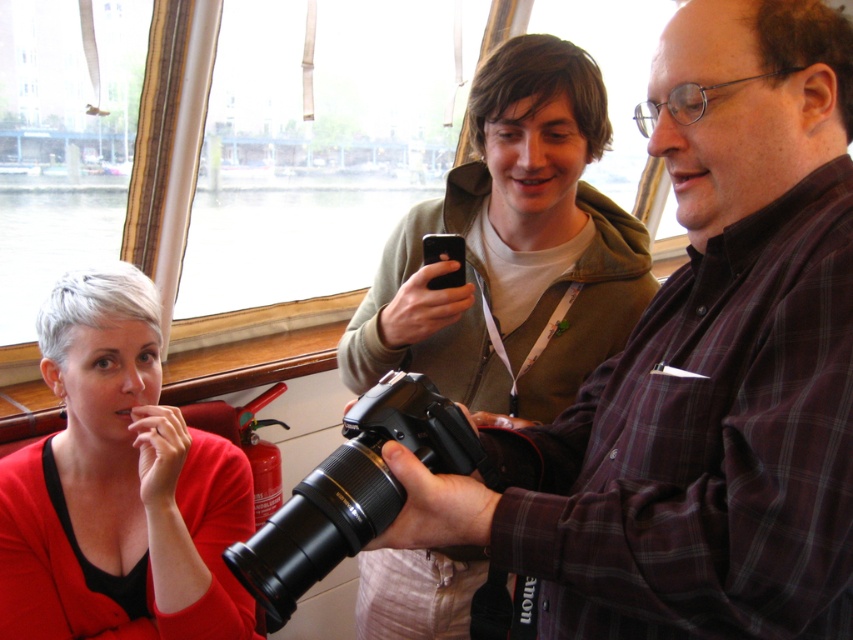
You are a photographer on a boat and need to take a photo of the plaid fabric shirt at center and the black plastic camera at center. Which object should you focus on first to ensure both are in the frame?

The plaid fabric shirt at center is in front of the black plastic camera at center, so you should focus on the black plastic camera at center first to ensure both are in the frame.

You are a photographer trying to place a matte red sweater at lower left and a black plastic camera at center on a shelf. The shelf has a width limit of 1 meter. Can both items fit side by side?

The matte red sweater at lower left is bigger than the black plastic camera at center, but since the exact sizes aren not provided, it is possible they could fit within the 1 meter shelf width if their combined size is under 1 meter. However, without specific measurements, we cannot confirm for certain.